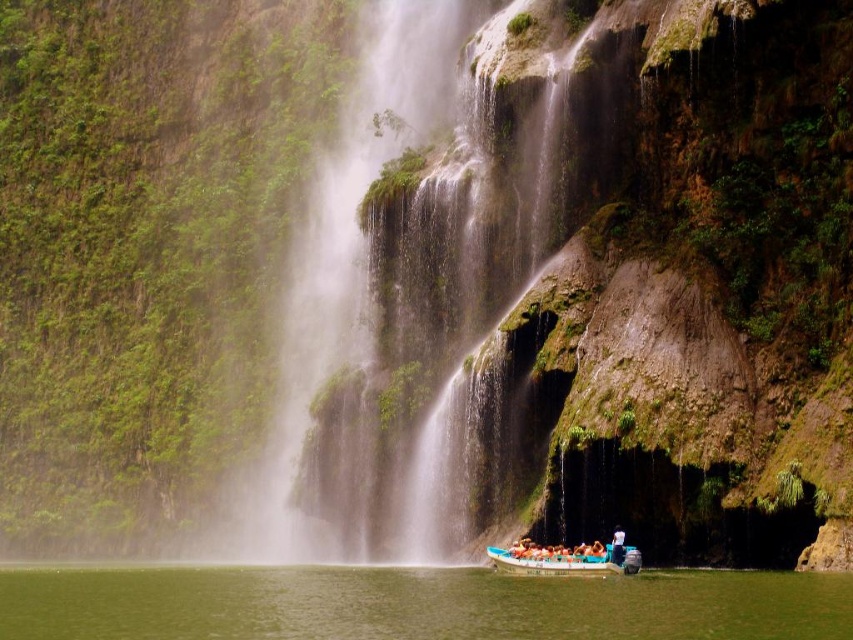
Is point (608, 616) farther from camera compared to point (614, 538)?

No, it is not.

Looking at this image, does green water at lower center have a greater width compared to white cotton shirt at lower center?

Correct, the width of green water at lower center exceeds that of white cotton shirt at lower center.

Is point (552, 595) in front of point (613, 557)?

Yes, it is.

Identify the location of green water at lower center. The width and height of the screenshot is (853, 640). (415, 604).

At what (x,y) coordinates should I click in order to perform the action: click on green mossy rock at center. Please return your answer as a coordinate pair (x, y). This screenshot has height=640, width=853. Looking at the image, I should click on (396, 308).

What do you see at coordinates (396, 308) in the screenshot?
I see `green mossy rock at center` at bounding box center [396, 308].

At what (x,y) coordinates should I click in order to perform the action: click on green mossy rock at center. Please return your answer as a coordinate pair (x, y). Looking at the image, I should click on (396, 308).

Consider the image. Which is more to the right, green mossy rock at center or blue plastic boat at center?

blue plastic boat at center

Does green mossy rock at center have a larger size compared to blue plastic boat at center?

Yes, green mossy rock at center is bigger than blue plastic boat at center.

This screenshot has height=640, width=853. I want to click on green mossy rock at center, so click(396, 308).